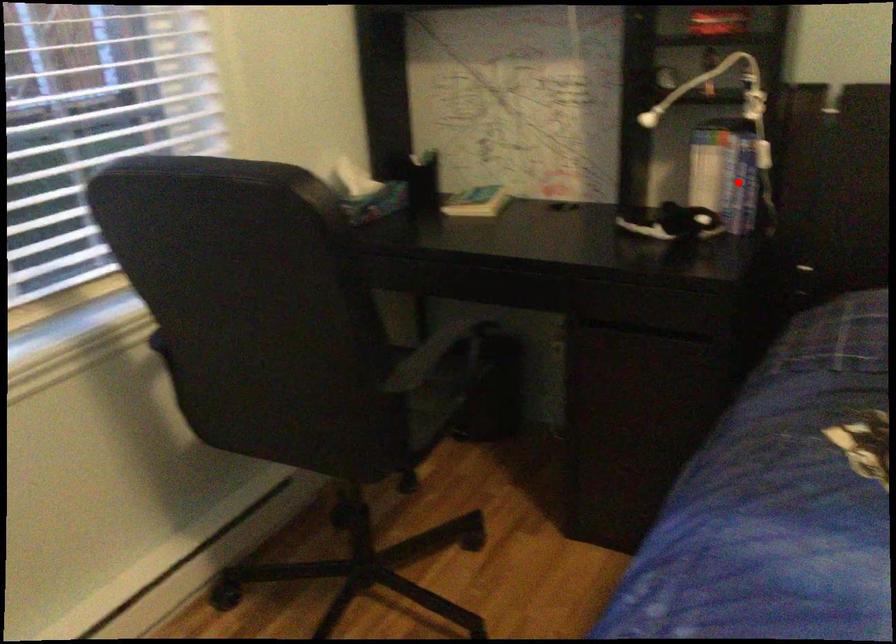
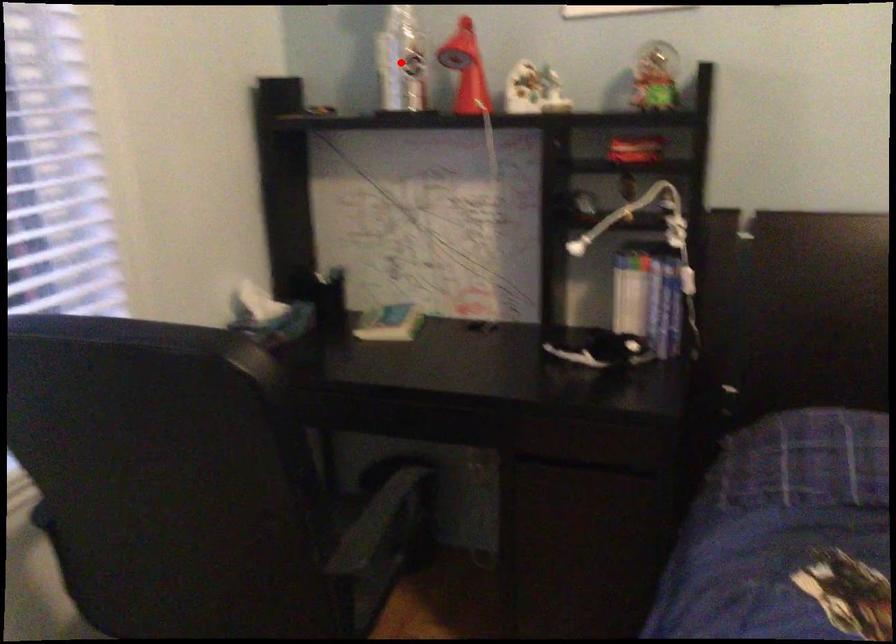
I am providing you with two images of the same scene from different viewpoints. A red point is marked on the first image and another point is marked on the second image. Does the point marked in image1 correspond to the same location as the one in image2?

No